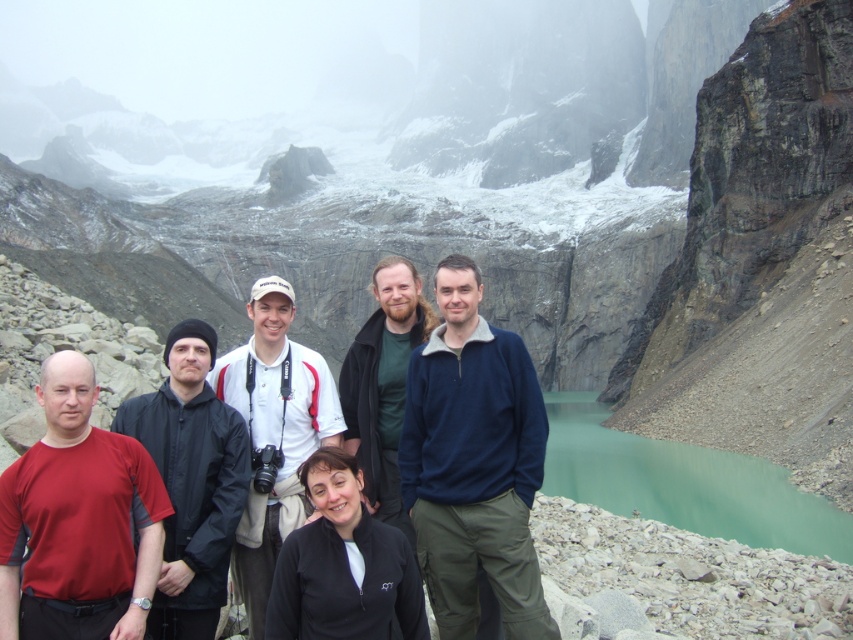
You are a photographer standing at the center of the group. You want to take a photo of the black matte jacket at left. Which direction should you move to face the jacket?

Since the black matte jacket at left is located at point [190,481] in the 2D space, you should move to your left to face the jacket.